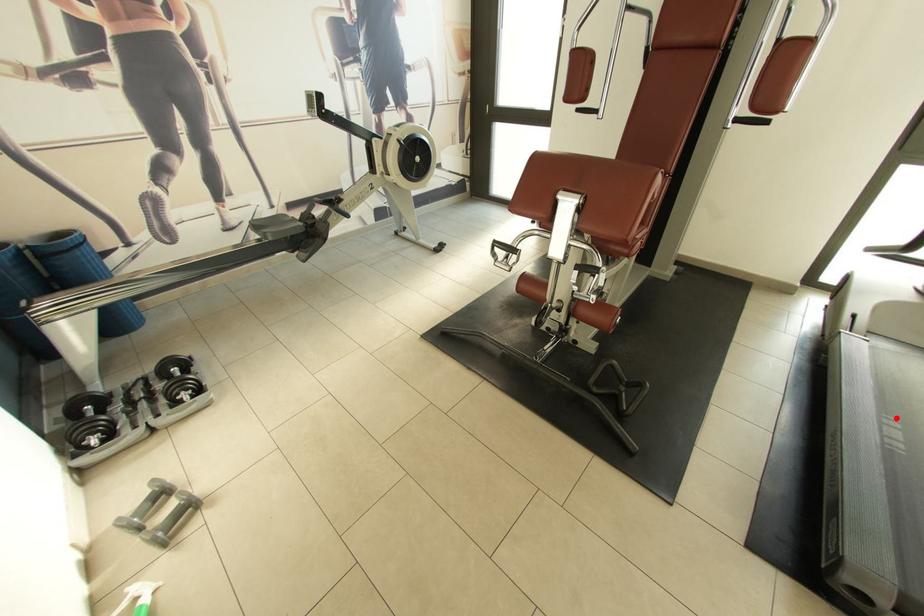
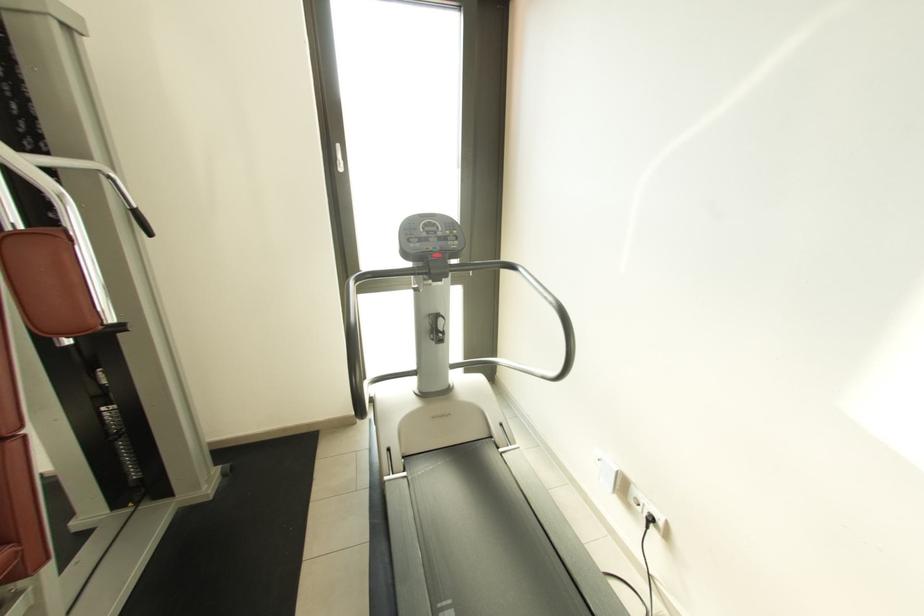
Question: A red point is marked in image1. In image2, is the corresponding 3D point closer to the camera or farther? Reply with the corresponding letter.

Choices:
 (A) The corresponding 3D point is closer.
 (B) The corresponding 3D point is farther.

Answer: (A)